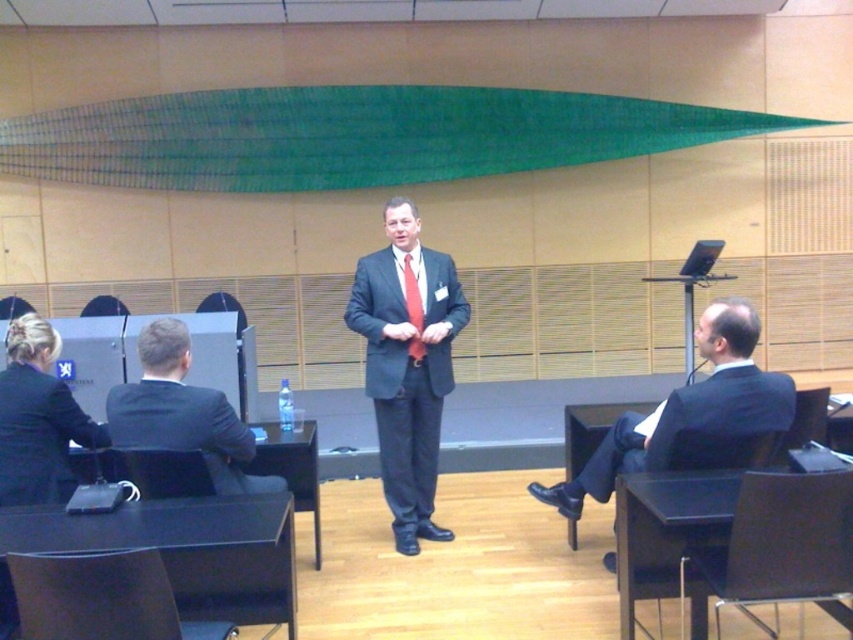
Does point (395, 385) lie behind point (415, 276)?

No, (395, 385) is closer to viewer.

Who is higher up, matte black suit at center or red silk tie at center?

red silk tie at center is higher up.

Is point (439, 364) closer to viewer compared to point (405, 300)?

No, it is not.

Identify the location of matte black suit at center. (407, 364).

Is matte black suit at center shorter than brown leather chair at lower left?

In fact, matte black suit at center may be taller than brown leather chair at lower left.

Which is in front, point (426, 268) or point (125, 563)?

Point (125, 563) is in front.

In the scene shown: Who is more distant from viewer, [386,456] or [76,611]?

Point [386,456]

Find the location of a particular element. matte black suit at center is located at coordinates (407, 364).

Does black suit at right have a greater height compared to black suit at left?

Yes, black suit at right is taller than black suit at left.

How much distance is there between black suit at right and black suit at left?

black suit at right and black suit at left are 4.82 feet apart from each other.

Who is more distant from viewer, [647,433] or [106,406]?

The point [647,433] is behind.

Find the location of a particular element. This screenshot has width=853, height=640. black suit at right is located at coordinates (733, 378).